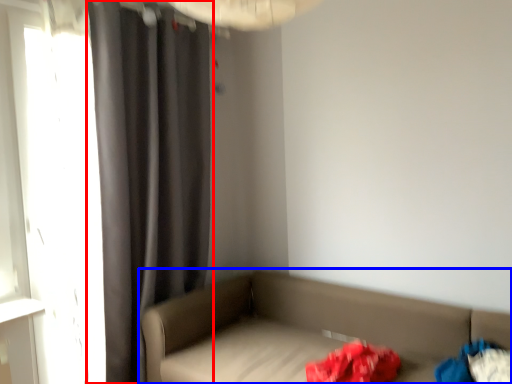
Question: Which of the following is the farthest to the observer, curtain (highlighted by a red box) or studio couch (highlighted by a blue box)?

Choices:
 (A) curtain
 (B) studio couch

Answer: (A)